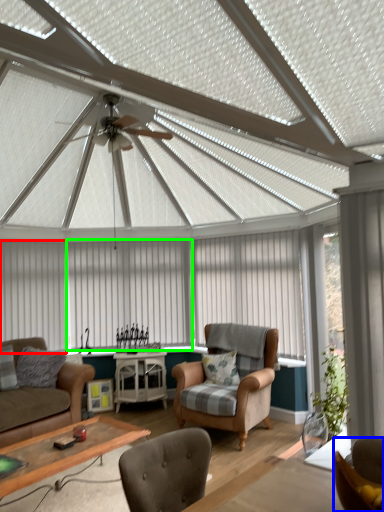
Question: Estimate the real-world distances between objects in this image. Which object is farther from curtain (highlighted by a red box), chair (highlighted by a blue box) or curtain (highlighted by a green box)?

Choices:
 (A) chair
 (B) curtain

Answer: (A)